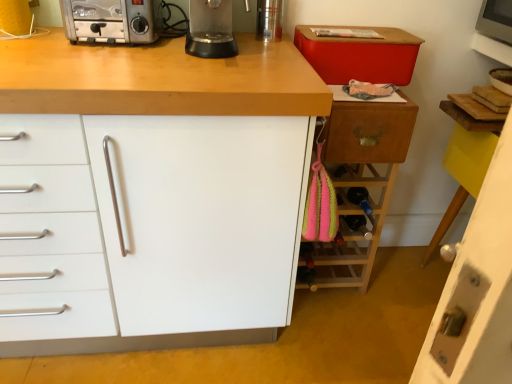
What do you see at coordinates (108, 21) in the screenshot? I see `silver metallic toaster at upper left` at bounding box center [108, 21].

Image resolution: width=512 pixels, height=384 pixels. Describe the element at coordinates (477, 290) in the screenshot. I see `white glossy door at lower right, the third cabinetry in the left-to-right sequence` at that location.

Where is `wooden drawer at right`? Image resolution: width=512 pixels, height=384 pixels. wooden drawer at right is located at coordinates (369, 132).

In order to face wooden drawer at right, should I rotate leftwards or rightwards?

It's best to rotate right around 14.216 degrees.

Identify the location of wooden wine rack at right, arranged as the 2th cabinetry when viewed from the left. (361, 181).

Which is behind, transparent plastic blender at center or wooden wine rack at right, arranged as the 2th cabinetry when viewed from the left?

wooden wine rack at right, arranged as the 2th cabinetry when viewed from the left, is further away from the camera.

Would you consider transparent plastic blender at center to be distant from wooden wine rack at right, arranged as the 2th cabinetry when viewed from the left?

Actually, transparent plastic blender at center and wooden wine rack at right, arranged as the 2th cabinetry when viewed from the left, are a little close together.

Between transparent plastic blender at center and wooden wine rack at right, the 2th cabinetry positioned from the right, which one has smaller width?

transparent plastic blender at center.

Does transparent plastic blender at center have a greater height compared to wooden wine rack at right, arranged as the 2th cabinetry when viewed from the left?

Incorrect, the height of transparent plastic blender at center is not larger of that of wooden wine rack at right, arranged as the 2th cabinetry when viewed from the left.

Can you confirm if transparent plastic blender at center is thinner than wooden drawer at right?

Incorrect, the width of transparent plastic blender at center is not less than that of wooden drawer at right.

From the image's perspective, which one is positioned lower, transparent plastic blender at center or wooden drawer at right?

wooden drawer at right is shown below in the image.

From a real-world perspective, relative to wooden drawer at right, is transparent plastic blender at center vertically above or below?

transparent plastic blender at center is above wooden drawer at right.

Is transparent plastic blender at center shorter than wooden drawer at right?

Yes.

Is white glossy door at lower right, the third cabinetry in the left-to-right sequence, oriented away from transparent plastic blender at center?

No, white glossy door at lower right, the third cabinetry in the left-to-right sequence, is not facing the opposite direction of transparent plastic blender at center.

From the image's perspective, does white glossy door at lower right, the third cabinetry in the left-to-right sequence, appear higher than transparent plastic blender at center?

Incorrect, from the image's perspective, white glossy door at lower right, the third cabinetry in the left-to-right sequence, is lower than transparent plastic blender at center.

How many degrees apart are the facing directions of white glossy door at lower right, the 1th cabinetry in the right-to-left sequence, and transparent plastic blender at center?

white glossy door at lower right, the 1th cabinetry in the right-to-left sequence, and transparent plastic blender at center are facing 90.1 degrees away from each other.

Which object is wider, white glossy door at lower right, the 1th cabinetry in the right-to-left sequence, or transparent plastic blender at center?

With larger width is transparent plastic blender at center.

Locate an element on the screen. The image size is (512, 384). the 1st cabinetry below the white matte cabinet at center, arranged as the 1th cabinetry when viewed from the left (from the image's perspective) is located at coordinates (361, 181).

Is white matte cabinet at center, arranged as the 1th cabinetry when viewed from the left, far away from wooden wine rack at right, arranged as the 2th cabinetry when viewed from the left?

No.

Which point is more forward, (71, 94) or (384, 175)?

The point (71, 94) is closer.

Is white matte cabinet at center, the 3th cabinetry in the right-to-left sequence, aimed at wooden wine rack at right, the 2th cabinetry positioned from the right?

No, white matte cabinet at center, the 3th cabinetry in the right-to-left sequence, is not turned towards wooden wine rack at right, the 2th cabinetry positioned from the right.

From a real-world perspective, is silver metallic toaster at upper left above or below white matte cabinet at center, the 3th cabinetry in the right-to-left sequence?

In terms of real-world spatial position, silver metallic toaster at upper left is above white matte cabinet at center, the 3th cabinetry in the right-to-left sequence.

Is silver metallic toaster at upper left smaller than white matte cabinet at center, arranged as the 1th cabinetry when viewed from the left?

Yes.

In the image, is silver metallic toaster at upper left on the left side or the right side of white matte cabinet at center, the 3th cabinetry in the right-to-left sequence?

From the image, it's evident that silver metallic toaster at upper left is to the right of white matte cabinet at center, the 3th cabinetry in the right-to-left sequence.

Does white matte cabinet at center, the 3th cabinetry in the right-to-left sequence, turn towards transparent plastic blender at center?

No, white matte cabinet at center, the 3th cabinetry in the right-to-left sequence, is not turned towards transparent plastic blender at center.

How many degrees apart are the facing directions of white matte cabinet at center, the 3th cabinetry in the right-to-left sequence, and transparent plastic blender at center?

9.56e-05 degrees.

Considering the relative sizes of white matte cabinet at center, the 3th cabinetry in the right-to-left sequence, and transparent plastic blender at center in the image provided, is white matte cabinet at center, the 3th cabinetry in the right-to-left sequence, wider than transparent plastic blender at center?

Yes, white matte cabinet at center, the 3th cabinetry in the right-to-left sequence, is wider than transparent plastic blender at center.

Based on the photo, from the image's perspective, is white matte cabinet at center, arranged as the 1th cabinetry when viewed from the left, located beneath transparent plastic blender at center?

Correct, white matte cabinet at center, arranged as the 1th cabinetry when viewed from the left, appears lower than transparent plastic blender at center in the image.

Between silver metallic toaster at upper left and wooden wine rack at right, the 2th cabinetry positioned from the right, which one has smaller size?

With smaller size is silver metallic toaster at upper left.

Locate an element on the screen. home appliance that is in front of the wooden wine rack at right, the 2th cabinetry positioned from the right is located at coordinates (108, 21).

Does silver metallic toaster at upper left have a greater width compared to wooden wine rack at right, arranged as the 2th cabinetry when viewed from the left?

In fact, silver metallic toaster at upper left might be narrower than wooden wine rack at right, arranged as the 2th cabinetry when viewed from the left.

From a real-world perspective, does silver metallic toaster at upper left sit lower than wooden wine rack at right, arranged as the 2th cabinetry when viewed from the left?

Actually, silver metallic toaster at upper left is physically above wooden wine rack at right, arranged as the 2th cabinetry when viewed from the left, in the real world.

The width and height of the screenshot is (512, 384). Find the location of `kitchen appliance in front of the wooden wine rack at right, the 2th cabinetry positioned from the right`. kitchen appliance in front of the wooden wine rack at right, the 2th cabinetry positioned from the right is located at coordinates (210, 29).

Where is `drawer on the right of the transparent plastic blender at center`? The image size is (512, 384). drawer on the right of the transparent plastic blender at center is located at coordinates (369, 132).

When comparing their distances from silver metallic toaster at upper left, does white matte cabinet at center, the 3th cabinetry in the right-to-left sequence, or transparent plastic blender at center seem further?

white matte cabinet at center, the 3th cabinetry in the right-to-left sequence.

Considering their positions, is wooden drawer at right positioned further to transparent plastic blender at center than wooden wine rack at right, the 2th cabinetry positioned from the right?

wooden wine rack at right, the 2th cabinetry positioned from the right, lies further to transparent plastic blender at center than the other object.

Based on their spatial positions, is white matte cabinet at center, the 3th cabinetry in the right-to-left sequence, or transparent plastic blender at center closer to white glossy door at lower right, the 1th cabinetry in the right-to-left sequence?

white matte cabinet at center, the 3th cabinetry in the right-to-left sequence.

Estimate the real-world distances between objects in this image. Which object is closer to wooden wine rack at right, the 2th cabinetry positioned from the right, white matte cabinet at center, the 3th cabinetry in the right-to-left sequence, or wooden drawer at right?

Based on the image, wooden drawer at right appears to be nearer to wooden wine rack at right, the 2th cabinetry positioned from the right.

Looking at the image, which one is located closer to white glossy door at lower right, the 1th cabinetry in the right-to-left sequence, wooden drawer at right or transparent plastic blender at center?

wooden drawer at right is closer to white glossy door at lower right, the 1th cabinetry in the right-to-left sequence.

Considering their positions, is white matte cabinet at center, arranged as the 1th cabinetry when viewed from the left, positioned closer to transparent plastic blender at center than white glossy door at lower right, the 1th cabinetry in the right-to-left sequence?

Among the two, white matte cabinet at center, arranged as the 1th cabinetry when viewed from the left, is located nearer to transparent plastic blender at center.

From the image, which object appears to be farther from wooden wine rack at right, arranged as the 2th cabinetry when viewed from the left, white matte cabinet at center, the 3th cabinetry in the right-to-left sequence, or white glossy door at lower right, the 1th cabinetry in the right-to-left sequence?

white glossy door at lower right, the 1th cabinetry in the right-to-left sequence, lies further to wooden wine rack at right, arranged as the 2th cabinetry when viewed from the left, than the other object.

From the image, which object appears to be farther from white matte cabinet at center, the 3th cabinetry in the right-to-left sequence, transparent plastic blender at center or white glossy door at lower right, the 1th cabinetry in the right-to-left sequence?

white glossy door at lower right, the 1th cabinetry in the right-to-left sequence, is further to white matte cabinet at center, the 3th cabinetry in the right-to-left sequence.

The image size is (512, 384). In order to click on cabinetry situated between transparent plastic blender at center and white glossy door at lower right, the 1th cabinetry in the right-to-left sequence, from left to right in this screenshot , I will do `click(361, 181)`.

The height and width of the screenshot is (384, 512). What are the coordinates of `cabinetry between white matte cabinet at center, the 3th cabinetry in the right-to-left sequence, and white glossy door at lower right, the third cabinetry in the left-to-right sequence` in the screenshot? It's located at (361, 181).

You are a GUI agent. You are given a task and a screenshot of the screen. Output one action in this format:
    pyautogui.click(x=<x>, y=<y>)
    Task: Click on the drawer situated between silver metallic toaster at upper left and white glossy door at lower right, the 1th cabinetry in the right-to-left sequence, from left to right
    
    Given the screenshot: What is the action you would take?
    pyautogui.click(x=369, y=132)

Locate an element on the screen. Image resolution: width=512 pixels, height=384 pixels. drawer that lies between transparent plastic blender at center and wooden wine rack at right, the 2th cabinetry positioned from the right, from top to bottom is located at coordinates (369, 132).